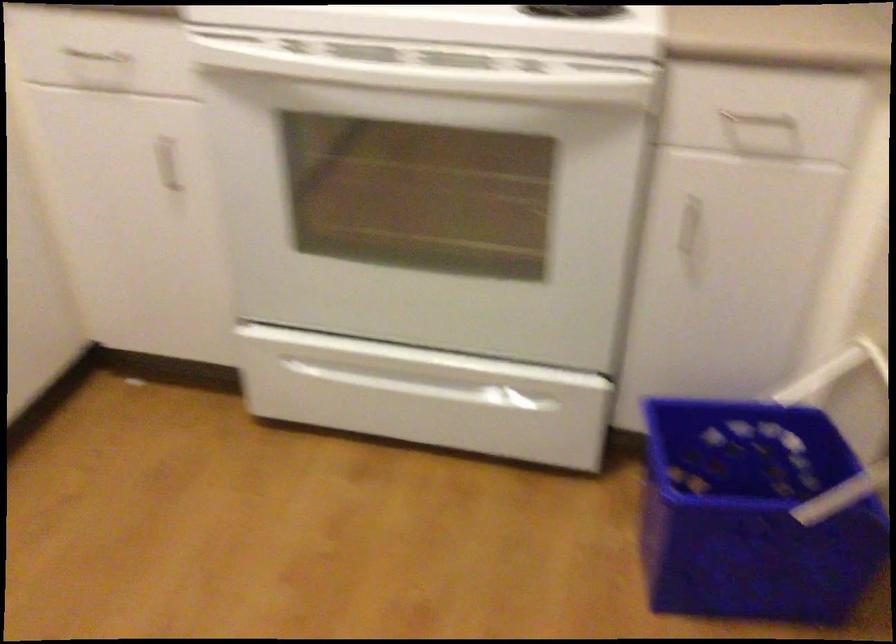
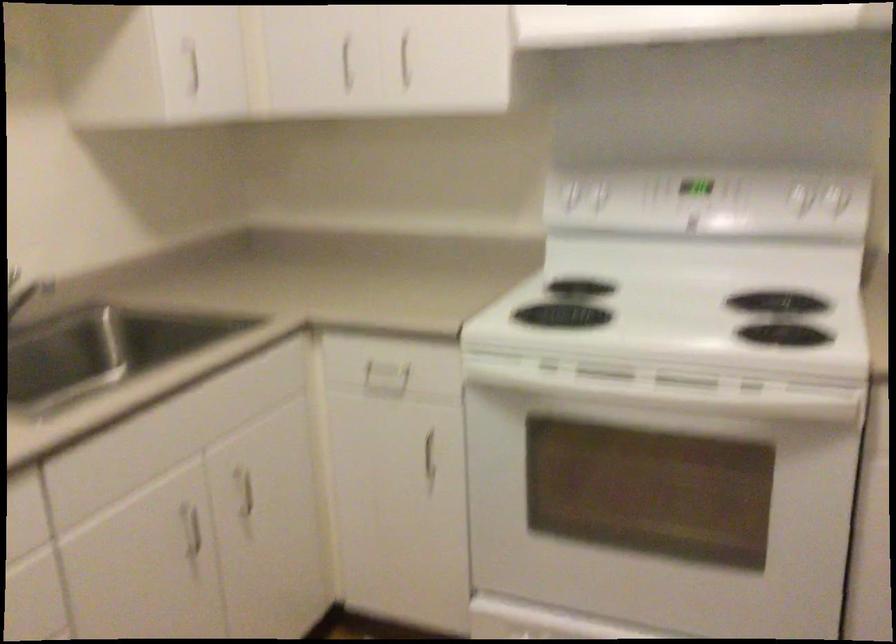
Question: The first image is from the beginning of the video and the second image is from the end. How did the camera likely rotate when shooting the video?

Choices:
 (A) Left
 (B) Right
 (C) Up
 (D) Down

Answer: (C)